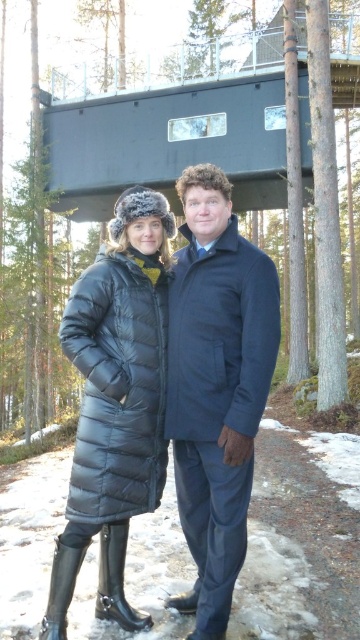
Between matte black coat at center and dark blue wool coat at center, which one appears on the right side from the viewer's perspective?

Positioned to the right is dark blue wool coat at center.

Between point (244, 493) and point (246, 486), which one is positioned in front?

Point (244, 493) is in front.

Where is `matte black coat at center`? matte black coat at center is located at coordinates [217, 387].